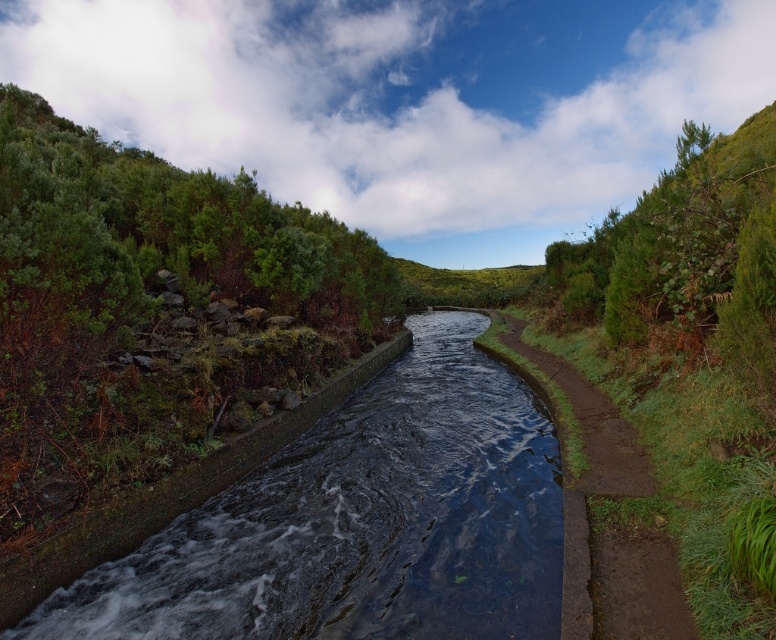
Question: Does green leafy shrubs at upper left have a smaller size compared to dark concrete stream at center?

Choices:
 (A) no
 (B) yes

Answer: (A)

Question: Can you confirm if green leafy shrubs at upper left is smaller than green leafy shrub at right?

Choices:
 (A) yes
 (B) no

Answer: (A)

Question: Which object appears farthest from the camera in this image?

Choices:
 (A) green leafy shrubs at upper left
 (B) green leafy shrub at right
 (C) dark concrete stream at center

Answer: (A)

Question: Among these objects, which one is nearest to the camera?

Choices:
 (A) green leafy shrub at right
 (B) green grassy trail at center-right
 (C) green leafy shrubs at upper left
 (D) dark concrete stream at center

Answer: (A)

Question: Among these points, which one is farthest from the camera?

Choices:
 (A) (291, 333)
 (B) (476, 376)

Answer: (B)

Question: Does dark concrete stream at center come behind green leafy shrub at right?

Choices:
 (A) no
 (B) yes

Answer: (B)